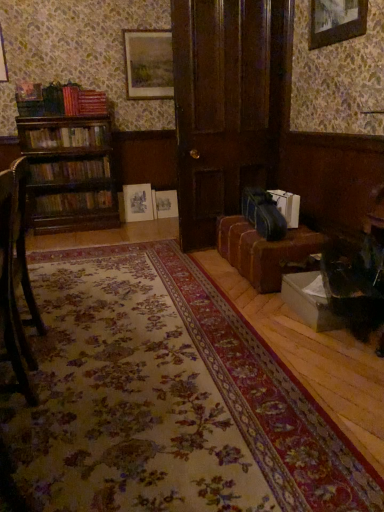
Locate an element on the screen. vacant space behind wooden chair at left is located at coordinates (71, 316).